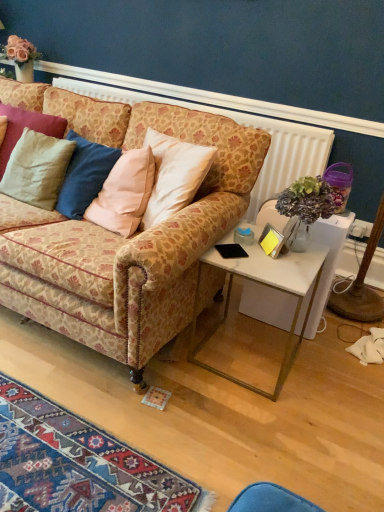
The height and width of the screenshot is (512, 384). Identify the location of empty space that is ontop of white marble side table at right (from a real-world perspective). (262, 254).